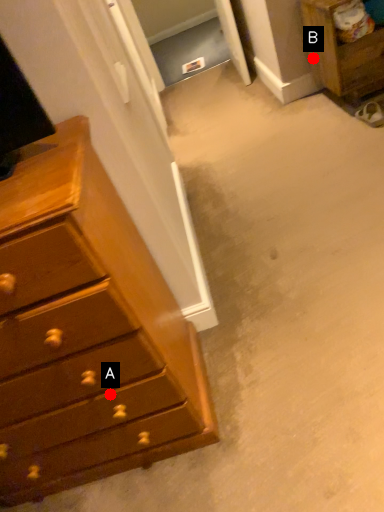
Question: Two points are circled on the image, labeled by A and B beside each circle. Which point is further to the camera?

Choices:
 (A) A is further
 (B) B is further

Answer: (B)